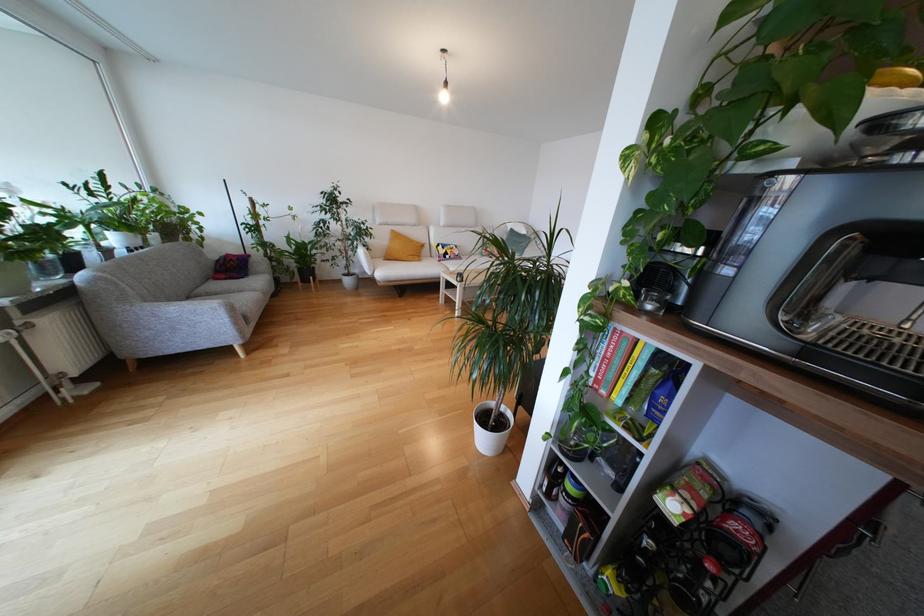
Find where to sit the grey sofa sitting surface. Please return your answer as a coordinate pair (x, y).

(172, 302)